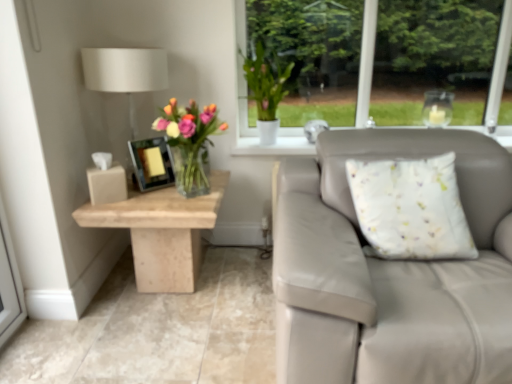
This screenshot has width=512, height=384. Find the location of `free spot below beige marble table at left (from a real-world perspective)`. free spot below beige marble table at left (from a real-world perspective) is located at coordinates (164, 292).